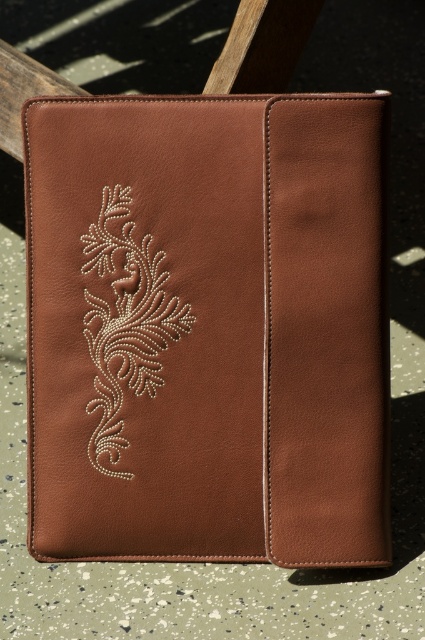
Question: Is matte leather folder at center positioned before white beaded floral design at center?

Choices:
 (A) yes
 (B) no

Answer: (A)

Question: Among these objects, which one is farthest from the camera?

Choices:
 (A) matte leather folder at center
 (B) white beaded floral design at center

Answer: (B)

Question: Is matte leather folder at center bigger than white beaded floral design at center?

Choices:
 (A) yes
 (B) no

Answer: (A)

Question: Which point is farther to the camera?

Choices:
 (A) (115, 371)
 (B) (303, 445)

Answer: (A)

Question: Is matte leather folder at center thinner than white beaded floral design at center?

Choices:
 (A) yes
 (B) no

Answer: (B)